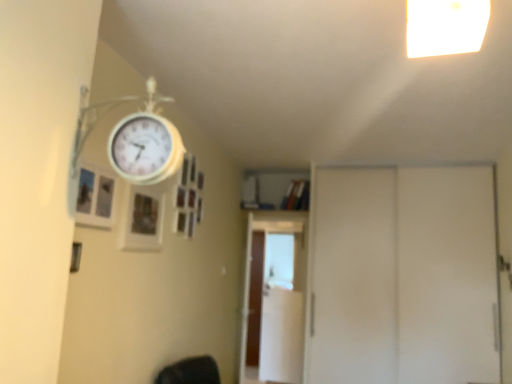
Question: Does brown wooden screen door at center, the 3th screen door when ordered from front to back, have a lesser height compared to wooden picture frame at upper center, which is the first picture frame from right to left?

Choices:
 (A) no
 (B) yes

Answer: (A)

Question: Considering the relative sizes of brown wooden screen door at center, the 3th screen door when ordered from front to back, and wooden picture frame at upper center, placed as the 2th picture frame when sorted from left to right, in the image provided, is brown wooden screen door at center, the 3th screen door when ordered from front to back, thinner than wooden picture frame at upper center, placed as the 2th picture frame when sorted from left to right,?

Choices:
 (A) yes
 (B) no

Answer: (B)

Question: Is brown wooden screen door at center, acting as the first screen door starting from the back, positioned with its back to wooden picture frame at upper center, placed as the 2th picture frame when sorted from left to right?

Choices:
 (A) yes
 (B) no

Answer: (B)

Question: Can you confirm if brown wooden screen door at center, acting as the first screen door starting from the back, is positioned to the left of wooden picture frame at upper center, marked as the 2th picture frame in a front-to-back arrangement?

Choices:
 (A) no
 (B) yes

Answer: (A)

Question: Is brown wooden screen door at center, the 3th screen door when ordered from front to back, beside wooden picture frame at upper center, the first picture frame when ordered from back to front?

Choices:
 (A) yes
 (B) no

Answer: (B)

Question: Based on their sizes in the image, would you say wooden picture frame at upper center, the first picture frame when ordered from back to front, is bigger or smaller than white matte screen door at right, which ranks as the third screen door in left-to-right order?

Choices:
 (A) small
 (B) big

Answer: (A)

Question: Do you think wooden picture frame at upper center, marked as the 2th picture frame in a front-to-back arrangement, is within white matte screen door at right, the 1th screen door positioned from the right, or outside of it?

Choices:
 (A) inside
 (B) outside

Answer: (B)

Question: Considering their positions, is wooden picture frame at upper center, the first picture frame when ordered from back to front, located in front of or behind white matte screen door at right, the 3th screen door viewed from the back?

Choices:
 (A) behind
 (B) front

Answer: (B)

Question: Considering the positions of point (122, 238) and point (373, 345), is point (122, 238) closer or farther from the camera than point (373, 345)?

Choices:
 (A) closer
 (B) farther

Answer: (A)

Question: Considering their positions, is white glossy screen door at center, marked as the second screen door in a left-to-right arrangement, located in front of or behind wooden picture frame at upper left, marked as the first picture frame in a left-to-right arrangement?

Choices:
 (A) behind
 (B) front

Answer: (A)

Question: Visually, is white glossy screen door at center, which appears as the second screen door when viewed from the back, positioned to the left or to the right of wooden picture frame at upper left, the second picture frame positioned from the right?

Choices:
 (A) left
 (B) right

Answer: (B)

Question: From the image's perspective, is white glossy screen door at center, marked as the second screen door in a left-to-right arrangement, located above or below wooden picture frame at upper left, marked as the first picture frame in a left-to-right arrangement?

Choices:
 (A) below
 (B) above

Answer: (A)

Question: In terms of width, does white glossy screen door at center, which appears as the second screen door when viewed from the back, look wider or thinner when compared to wooden picture frame at upper left, placed as the second picture frame when sorted from back to front?

Choices:
 (A) thin
 (B) wide

Answer: (B)

Question: From a real-world perspective, is brown wooden screen door at center, the 3th screen door when ordered from front to back, positioned above or below white glossy screen door at center, the 2th screen door from the right?

Choices:
 (A) below
 (B) above

Answer: (A)

Question: Would you say brown wooden screen door at center, the 3th screen door when ordered from front to back, is inside or outside white glossy screen door at center, marked as the second screen door in a left-to-right arrangement?

Choices:
 (A) inside
 (B) outside

Answer: (B)